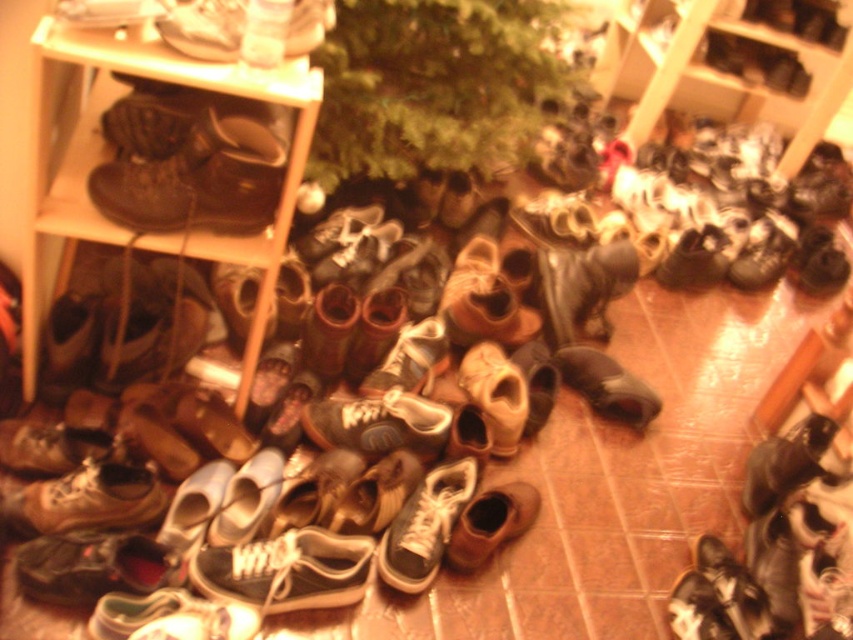
Question: Which point is farther to the camera?

Choices:
 (A) shiny brown shoe at center
 (B) black leather shoe at lower right

Answer: (A)

Question: Does black leather shoe at lower right come behind brown leather boot at upper left?

Choices:
 (A) yes
 (B) no

Answer: (A)

Question: Is black leather shoe at lower right positioned in front of matte black sneaker at center?

Choices:
 (A) no
 (B) yes

Answer: (A)

Question: Which point is closer to the camera?

Choices:
 (A) brown leather boots at left
 (B) shiny brown sneaker at center
 (C) black canvas sneaker at center
 (D) brown leather sneaker at lower left

Answer: (A)

Question: Where is brown leather boots at left located in relation to matte black sneaker at center in the image?

Choices:
 (A) above
 (B) below

Answer: (A)

Question: Which object is farther from the camera taking this photo?

Choices:
 (A) matte white shoe at upper left
 (B) shiny brown sneaker at center
 (C) shiny brown shoe at center
 (D) brown leather boots at left

Answer: (C)